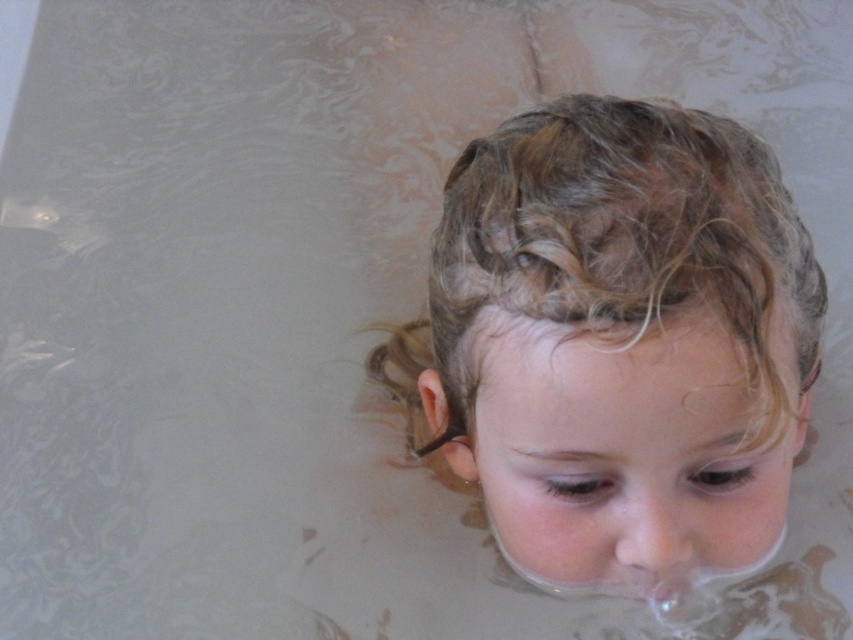
You are a photographer trying to capture a closeup of the curly blonde hair at center. If your camera is set to focus at 40 centimeters, will the subject be in focus?

The curly blonde hair at center and camera are 43.94 centimeters apart from each other. Since the camera is set to focus at 40 centimeters, the subject is slightly farther away, so it might not be in focus. Adjust the focus to 44 centimeters for better clarity.

You are a photographer trying to capture the texture of the curly blonde hair at center in the image. Since the lighting is soft and natural, where should you position yourself relative to the point marked as point (x=614, y=330) to ensure the light highlights the hair effectively?

To effectively highlight the curly blonde hair at center, position yourself so the light source is behind you and facing the hair at point (x=614, y=330). This ensures the soft natural light illuminates the hair directly, enhancing its texture.

You are a photographer trying to capture the texture of the curly blonde hair at center. Based on the coordinates provided, where should you focus your camera lens to ensure the hair is in sharp focus?

To ensure the curly blonde hair at center is in sharp focus, you should focus your camera lens at the coordinates point specified at point [614,330].